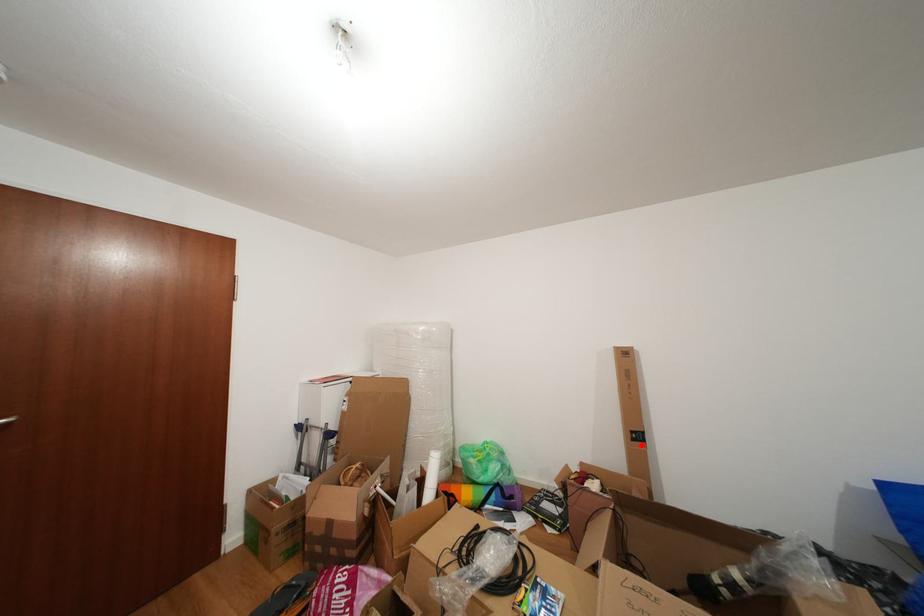
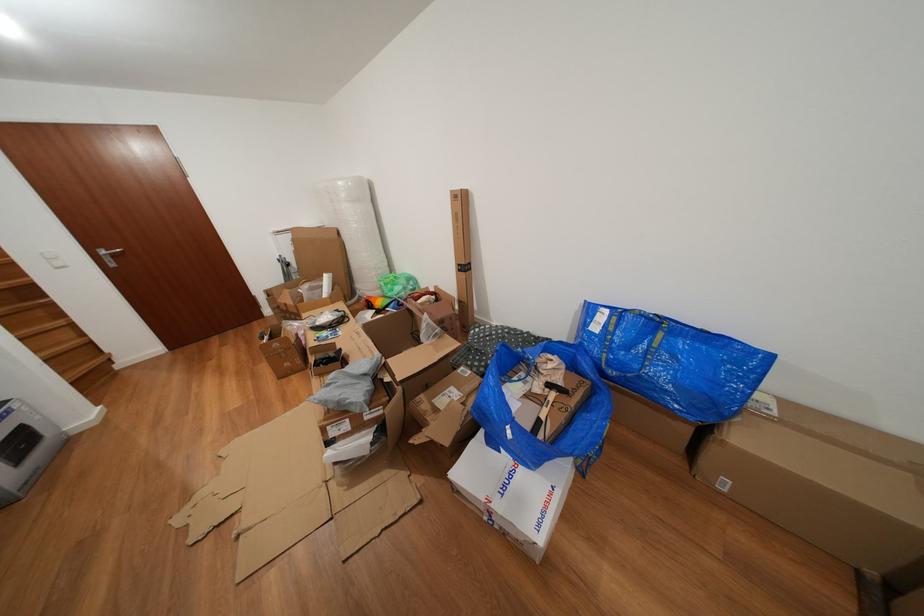
Question: I am providing you with two images of the same scene from different viewpoints. A red point is shown in image1. For the corresponding object point in image2, is it positioned nearer or farther from the camera?

Choices:
 (A) Nearer
 (B) Farther

Answer: (A)